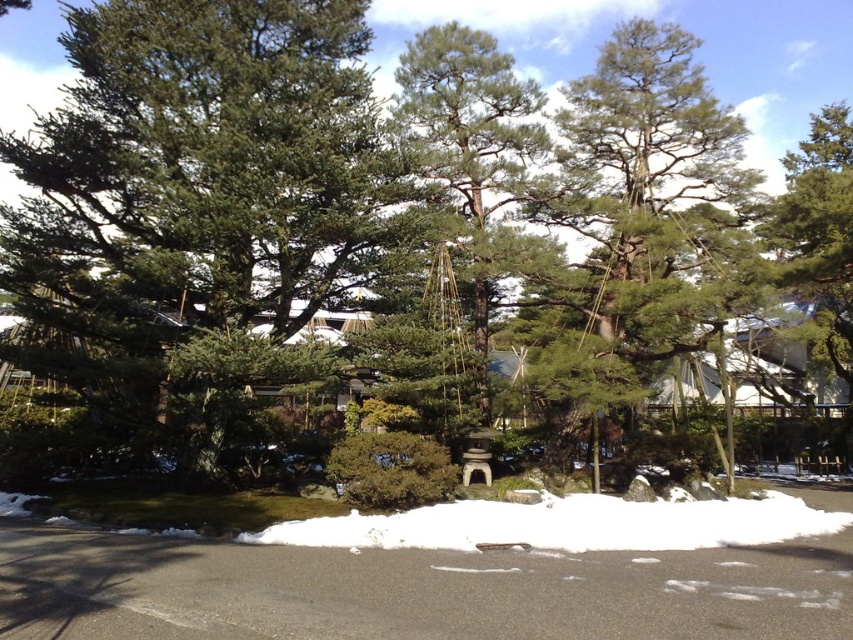
Question: From the image, what is the correct spatial relationship of green matte tree at center in relation to green textured tree at center?

Choices:
 (A) right
 (B) left

Answer: (B)

Question: Does green needle-like at center have a lesser width compared to white powdery snow at center?

Choices:
 (A) yes
 (B) no

Answer: (B)

Question: Does green needle-like at center appear under white powdery snow at center?

Choices:
 (A) no
 (B) yes

Answer: (A)

Question: Estimate the real-world distances between objects in this image. Which object is farther from the white powdery snow at center?

Choices:
 (A) green needle-like at center
 (B) green textured tree at center

Answer: (B)

Question: Among these points, which one is farthest from the camera?

Choices:
 (A) (193, 376)
 (B) (457, 502)
 (C) (660, 316)

Answer: (C)

Question: Which of these objects is positioned closest to the green needle-like at center?

Choices:
 (A) green matte tree at center
 (B) green textured tree at center

Answer: (B)